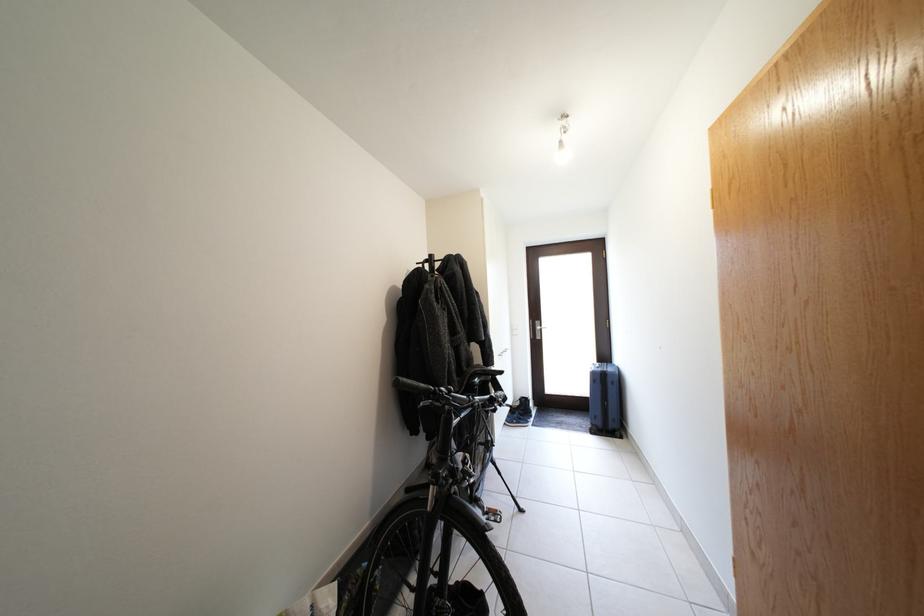
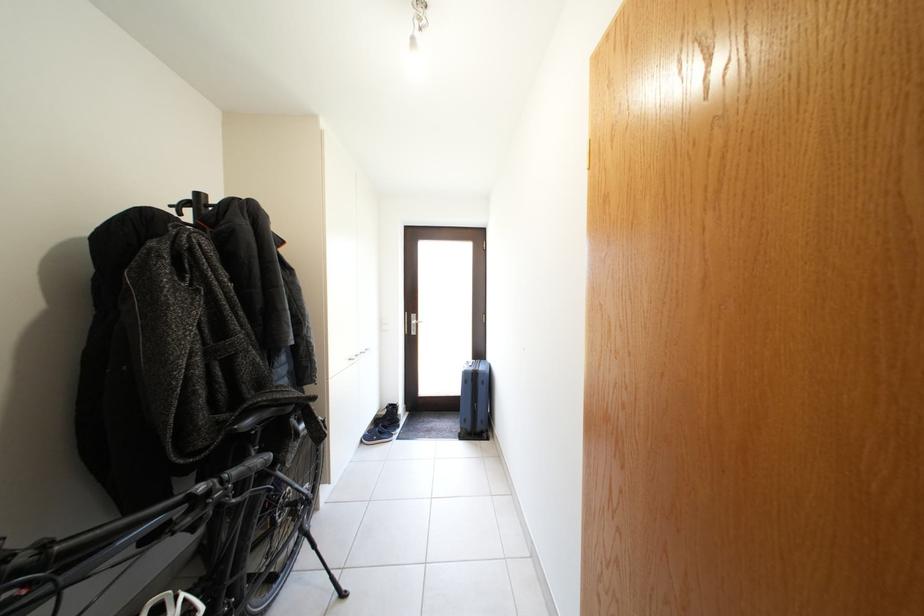
Question: Based on the continuous images, in which direction is the camera rotating? Reply with the corresponding letter.

Choices:
 (A) Left
 (B) Right
 (C) Up
 (D) Down

Answer: (B)